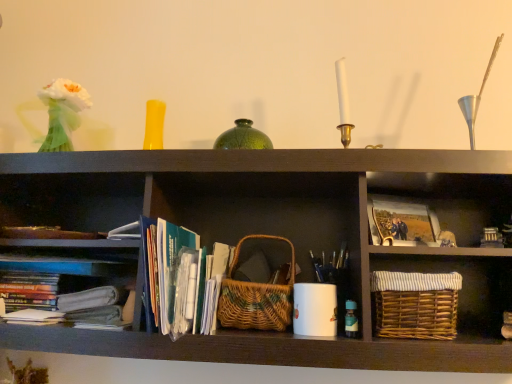
Question: Should I look upward or downward to see green paperbacks at center?

Choices:
 (A) down
 (B) up

Answer: (A)

Question: Is woven natural basket at center, the first basket when ordered from left to right, oriented away from woven brown basket at lower right, the 2th basket when ordered from left to right?

Choices:
 (A) yes
 (B) no

Answer: (B)

Question: Would you say woven natural basket at center, the first basket when ordered from left to right, is outside woven brown basket at lower right, which ranks as the 1th basket in right-to-left order?

Choices:
 (A) no
 (B) yes

Answer: (B)

Question: Is the surface of woven natural basket at center, which ranks as the 2th basket in right-to-left order, in direct contact with woven brown basket at lower right, which ranks as the 1th basket in right-to-left order?

Choices:
 (A) yes
 (B) no

Answer: (B)

Question: Considering the relative positions of woven natural basket at center, which ranks as the 2th basket in right-to-left order, and woven brown basket at lower right, the 2th basket when ordered from left to right, in the image provided, is woven natural basket at center, which ranks as the 2th basket in right-to-left order, behind woven brown basket at lower right, the 2th basket when ordered from left to right,?

Choices:
 (A) yes
 (B) no

Answer: (A)

Question: Considering the relative sizes of woven natural basket at center, the first basket when ordered from left to right, and woven brown basket at lower right, which ranks as the 1th basket in right-to-left order, in the image provided, is woven natural basket at center, the first basket when ordered from left to right, thinner than woven brown basket at lower right, which ranks as the 1th basket in right-to-left order,?

Choices:
 (A) no
 (B) yes

Answer: (B)

Question: Does woven natural basket at center, the first basket when ordered from left to right, have a greater height compared to woven brown basket at lower right, which ranks as the 1th basket in right-to-left order?

Choices:
 (A) no
 (B) yes

Answer: (B)

Question: Is matte paper photo at center right facing towards woven brown basket at lower right, which ranks as the 1th basket in right-to-left order?

Choices:
 (A) no
 (B) yes

Answer: (A)

Question: Can you confirm if matte paper photo at center right is shorter than woven brown basket at lower right, which ranks as the 1th basket in right-to-left order?

Choices:
 (A) yes
 (B) no

Answer: (A)

Question: Can you confirm if matte paper photo at center right is taller than woven brown basket at lower right, the 2th basket when ordered from left to right?

Choices:
 (A) yes
 (B) no

Answer: (B)

Question: Is matte paper photo at center right positioned behind woven brown basket at lower right, the 2th basket when ordered from left to right?

Choices:
 (A) yes
 (B) no

Answer: (A)

Question: Is matte paper photo at center right positioned in front of woven brown basket at lower right, which ranks as the 1th basket in right-to-left order?

Choices:
 (A) yes
 (B) no

Answer: (B)

Question: Is woven brown basket at lower right, the 2th basket when ordered from left to right, surrounded by matte paper photo at center right?

Choices:
 (A) no
 (B) yes

Answer: (A)

Question: Can you confirm if woven natural basket at center, which ranks as the 2th basket in right-to-left order, is bigger than translucent glass bottle at lower right?

Choices:
 (A) no
 (B) yes

Answer: (B)